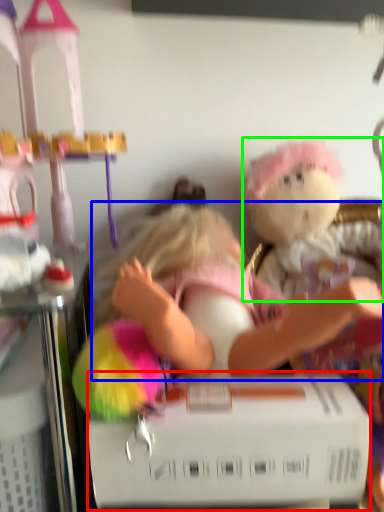
Question: Which object is positioned closest to box (highlighted by a red box)? Select from person (highlighted by a blue box) and toy (highlighted by a green box).

Choices:
 (A) person
 (B) toy

Answer: (A)